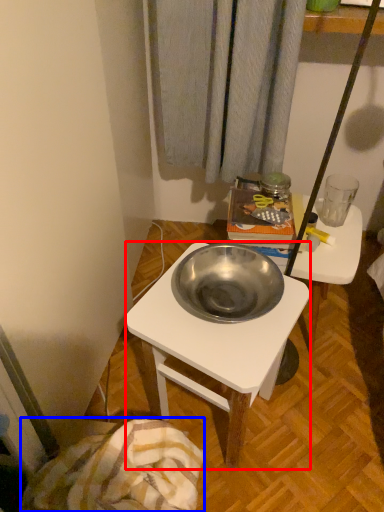
Question: Which point is closer to the camera, desk (highlighted by a red box) or blanket (highlighted by a blue box)?

Choices:
 (A) desk
 (B) blanket

Answer: (B)